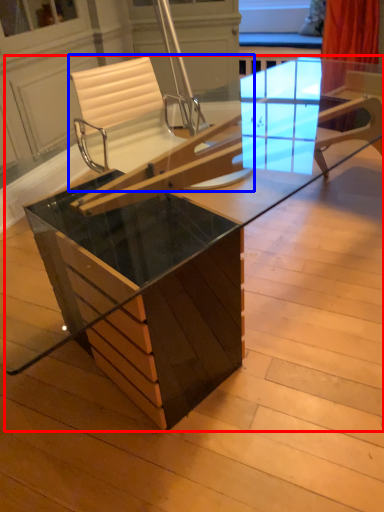
Question: Which object appears closest to the camera in this image, table (highlighted by a red box) or chair (highlighted by a blue box)?

Choices:
 (A) table
 (B) chair

Answer: (A)